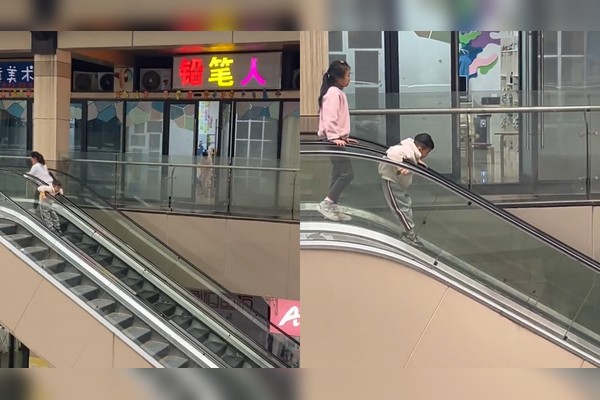
I want to click on air conditioner, so click(157, 76), click(103, 81), click(87, 81).